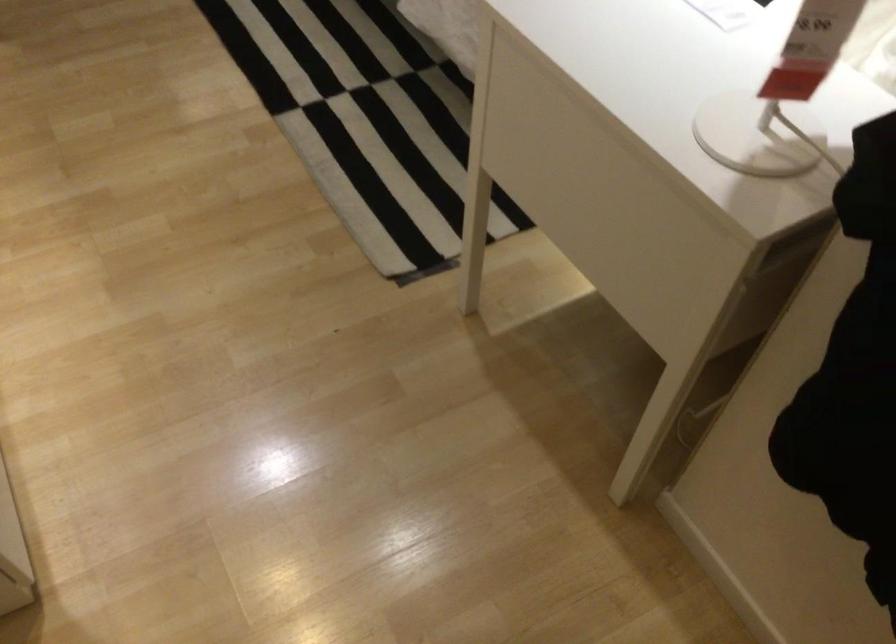
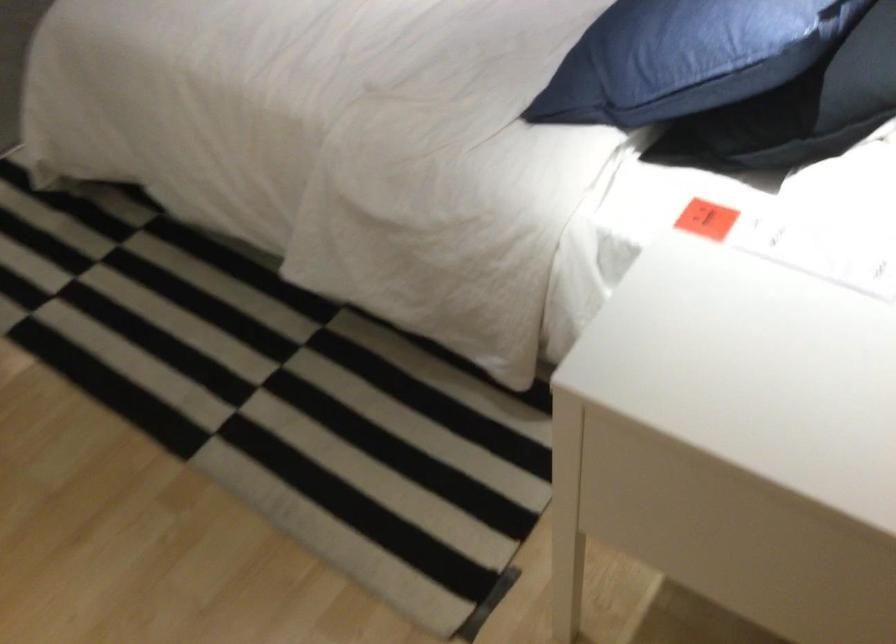
Question: The camera is either moving clockwise (left) or counter-clockwise (right) around the object. The first image is from the beginning of the video and the second image is from the end. Is the camera moving left or right when shooting the video?

Choices:
 (A) Left
 (B) Right

Answer: (A)